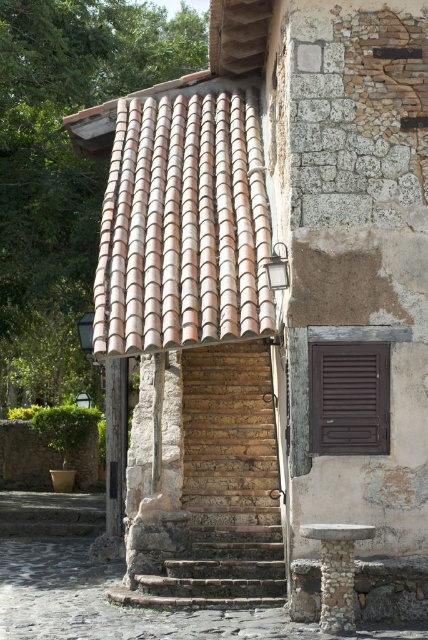
You are an architect designing a replica of this entranceway. The terracotta tiles at upper left are crucial for the design. Where exactly should you place them in terms of coordinates?

The terracotta tiles at upper left should be placed at coordinates point (184, 224).

You are standing in front of the rustic entranceway and want to touch both points on the structure. Which point should you reach for first, the point at coordinate (235,534) or the point at coordinate (359,385)?

You should reach for the point at coordinate (235,534) first because it is closer to you than the point at coordinate (359,385), which is further away.

You are standing in front of the rustic entranceway and notice two points marked on the structure. The first point is at coordinates point (181, 330) and the second is at point (379, 404). Which point is closer to you?

Point (181, 330) is further to the camera than point (379, 404), so the point closer to you is point (379, 404).